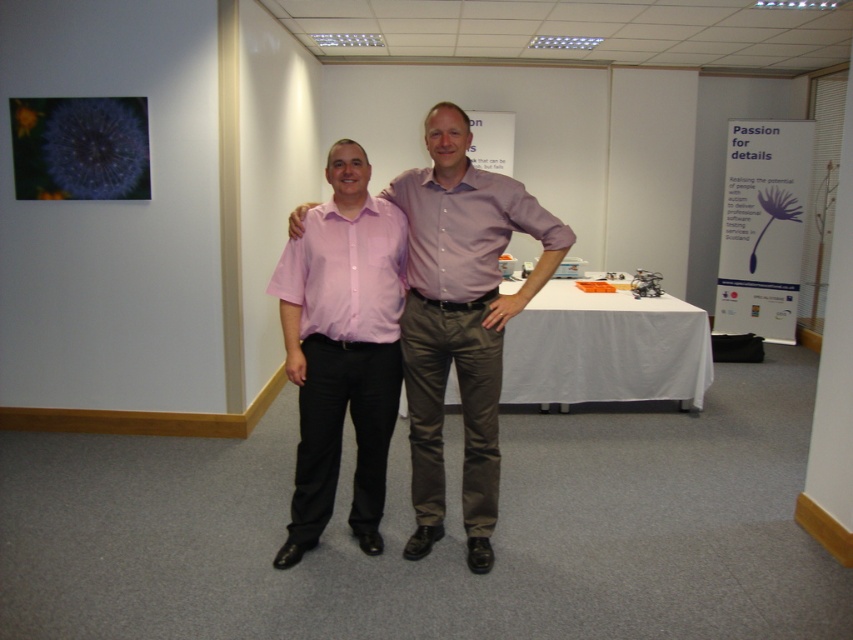
Where is `white cloth at center`? white cloth at center is located at coordinates (605, 349).

Does white cloth at center have a lesser height compared to matte purple shirt at center?

In fact, white cloth at center may be taller than matte purple shirt at center.

Measure the distance between white cloth at center and camera.

white cloth at center is 4.32 meters away from camera.

This screenshot has width=853, height=640. I want to click on white cloth at center, so click(605, 349).

Which is behind, point (357, 225) or point (410, 282)?

Point (410, 282)

The height and width of the screenshot is (640, 853). Find the location of `pink smooth shirt at center`. pink smooth shirt at center is located at coordinates (346, 273).

Is pink cotton shirt at center taller than pink smooth shirt at center?

Correct, pink cotton shirt at center is much taller as pink smooth shirt at center.

Who is higher up, pink cotton shirt at center or pink smooth shirt at center?

pink smooth shirt at center

Which is in front, point (451, 360) or point (286, 266)?

Point (286, 266) is more forward.

Identify the location of pink cotton shirt at center. (461, 317).